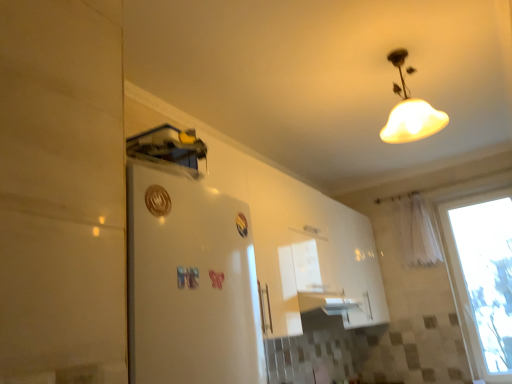
Question: Looking at the image, does white sheer curtain at right seem bigger or smaller compared to transparent glass window at right?

Choices:
 (A) small
 (B) big

Answer: (A)

Question: Would you say white sheer curtain at right is to the left or to the right of transparent glass window at right in the picture?

Choices:
 (A) left
 (B) right

Answer: (A)

Question: Which is nearer to the white matte lampshade at upper center?

Choices:
 (A) white sheer curtain at right
 (B) transparent glass window at right

Answer: (A)

Question: Based on their relative distances, which object is farther from the white matte lampshade at upper center?

Choices:
 (A) white sheer curtain at right
 (B) transparent glass window at right

Answer: (B)